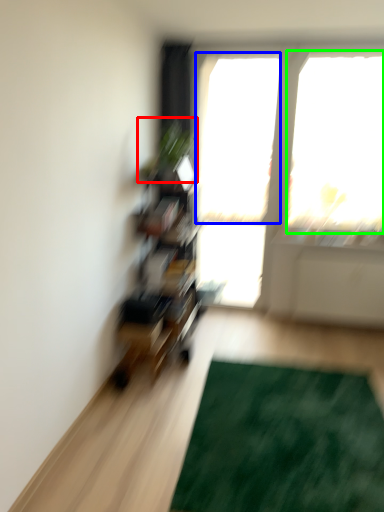
Question: Which is nearer to the plant (highlighted by a red box)? window screen (highlighted by a blue box) or window screen (highlighted by a green box).

Choices:
 (A) window screen
 (B) window screen

Answer: (A)